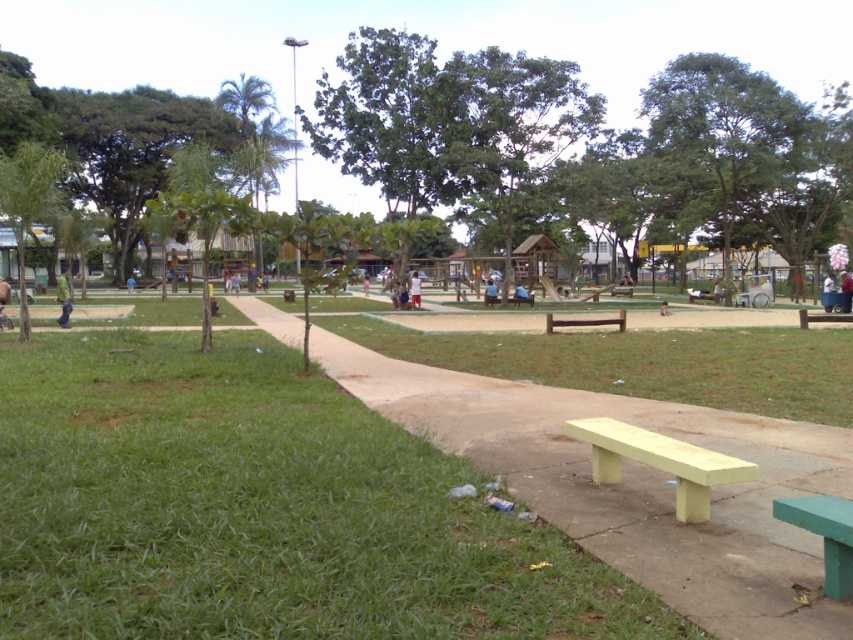
Question: Estimate the real-world distances between objects in this image. Which object is closer to the yellow wood bench at center?

Choices:
 (A) green painted wood bench at lower right
 (B) green leafy tree at left
 (C) green leafy tree at upper left
 (D) yellow wood bench at lower center

Answer: (D)

Question: Among these points, which one is nearest to the camera?

Choices:
 (A) (547, 321)
 (B) (428, 112)

Answer: (A)

Question: Can you confirm if green leafy tree at upper left is positioned above green painted wood bench at lower right?

Choices:
 (A) yes
 (B) no

Answer: (A)

Question: Is green leafy tree at left below yellow painted wood bench at lower right?

Choices:
 (A) no
 (B) yes

Answer: (A)

Question: Which point appears farthest from the camera in this image?

Choices:
 (A) (628, 464)
 (B) (692, 56)
 (C) (850, 310)

Answer: (B)

Question: Can you confirm if brown wooden bench at center is positioned below yellow painted wood bench at lower right?

Choices:
 (A) yes
 (B) no

Answer: (A)